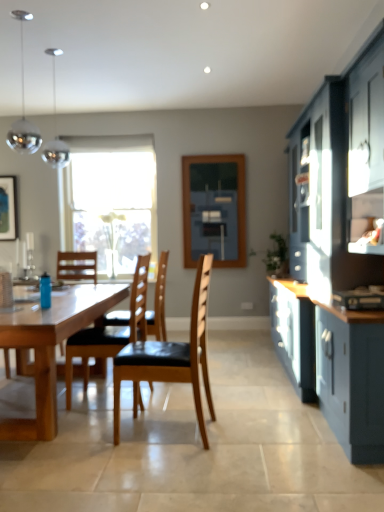
Find the location of a particular element. free space below brown leather chair at center, which is the first chair in front-to-back order (from a real-world perspective) is located at coordinates pos(168,430).